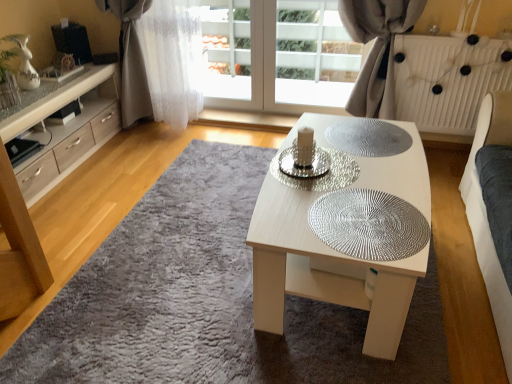
Question: From a real-world perspective, is silver textured glass plate at center, the 2th glass plate in the front-to-back sequence, positioned under light wood cabinet at left based on gravity?

Choices:
 (A) yes
 (B) no

Answer: (B)

Question: Does silver textured glass plate at center, the second glass plate when ordered from back to front, have a lesser height compared to light wood cabinet at left?

Choices:
 (A) yes
 (B) no

Answer: (A)

Question: From the image's perspective, does silver textured glass plate at center, the second glass plate when ordered from back to front, appear lower than light wood cabinet at left?

Choices:
 (A) no
 (B) yes

Answer: (B)

Question: Considering the relative sizes of silver textured glass plate at center, the 2th glass plate in the front-to-back sequence, and light wood cabinet at left in the image provided, is silver textured glass plate at center, the 2th glass plate in the front-to-back sequence, bigger than light wood cabinet at left?

Choices:
 (A) no
 (B) yes

Answer: (A)

Question: Is silver textured glass plate at center, the second glass plate when ordered from back to front, not within light wood cabinet at left?

Choices:
 (A) no
 (B) yes

Answer: (B)

Question: Is silver textured glass plate at center, the second glass plate when ordered from back to front, oriented towards light wood cabinet at left?

Choices:
 (A) yes
 (B) no

Answer: (A)

Question: Does silver textured glass plate at center, positioned as the first glass plate in back-to-front order, have a smaller size compared to white fabric curtain at upper center, placed as the second curtain when sorted from left to right?

Choices:
 (A) no
 (B) yes

Answer: (B)

Question: From the image's perspective, is silver textured glass plate at center, marked as the third glass plate in a front-to-back arrangement, beneath white fabric curtain at upper center, arranged as the 1th curtain when viewed from the right?

Choices:
 (A) yes
 (B) no

Answer: (A)

Question: From a real-world perspective, does silver textured glass plate at center, marked as the third glass plate in a front-to-back arrangement, stand above white fabric curtain at upper center, placed as the second curtain when sorted from left to right?

Choices:
 (A) yes
 (B) no

Answer: (B)

Question: Considering the relative sizes of silver textured glass plate at center, marked as the third glass plate in a front-to-back arrangement, and white fabric curtain at upper center, arranged as the 1th curtain when viewed from the right, in the image provided, is silver textured glass plate at center, marked as the third glass plate in a front-to-back arrangement, thinner than white fabric curtain at upper center, arranged as the 1th curtain when viewed from the right,?

Choices:
 (A) yes
 (B) no

Answer: (B)

Question: From the image's perspective, does silver textured glass plate at center, marked as the third glass plate in a front-to-back arrangement, appear higher than white fabric curtain at upper center, placed as the second curtain when sorted from left to right?

Choices:
 (A) yes
 (B) no

Answer: (B)

Question: From a real-world perspective, is silver textured glass plate at center, positioned as the first glass plate in back-to-front order, located beneath white fabric curtain at upper center, arranged as the 1th curtain when viewed from the right?

Choices:
 (A) no
 (B) yes

Answer: (B)

Question: Does white sheer curtain at upper left, the 1th curtain in the left-to-right sequence, have a greater height compared to silver textured glass plate at center, the 2th glass plate in the front-to-back sequence?

Choices:
 (A) no
 (B) yes

Answer: (B)